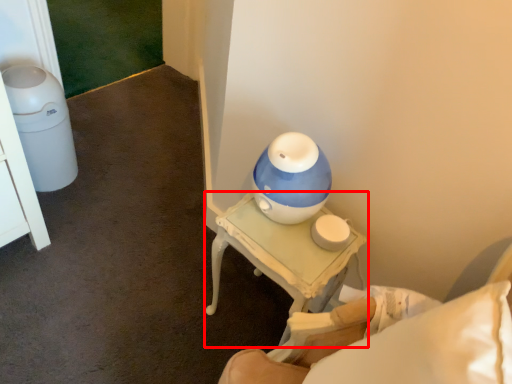
Question: In this image, where is table (annotated by the red box) located relative to furniture?

Choices:
 (A) right
 (B) left

Answer: (B)